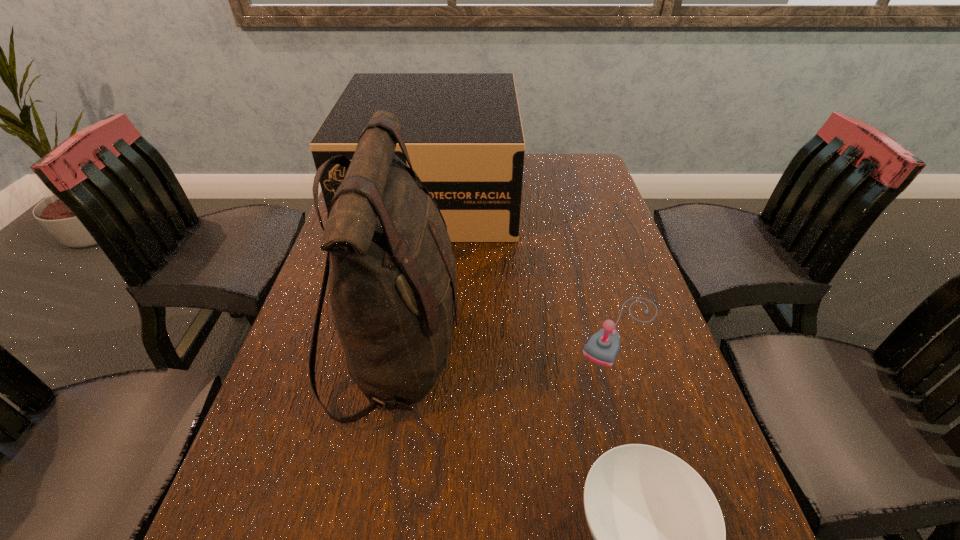
This screenshot has height=540, width=960. Identify the location of free space that satisfies the following two spatial constraints: 1. on the front side of the joystick; 2. on the open flap of the backpack. (628, 352).

Identify the location of free point that satisfies the following two spatial constraints: 1. on the front-facing side of the third shortest object; 2. on the open flap of the tallest object. 411,352.

This screenshot has height=540, width=960. In order to click on free region that satisfies the following two spatial constraints: 1. on the front-facing side of the box; 2. on the open flap of the tallest object in this screenshot , I will do `click(411, 352)`.